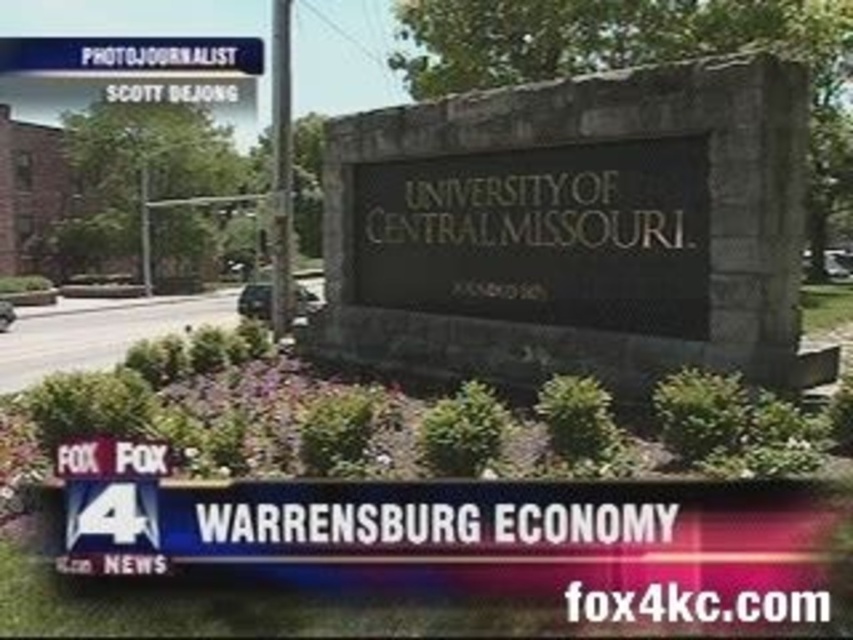
You are standing in front of the University of Central Missouri sign and want to locate the black stone sign at center. According to the coordinates provided, where exactly should you look to find it?

The black stone sign at center is located at coordinates point (132, 52).